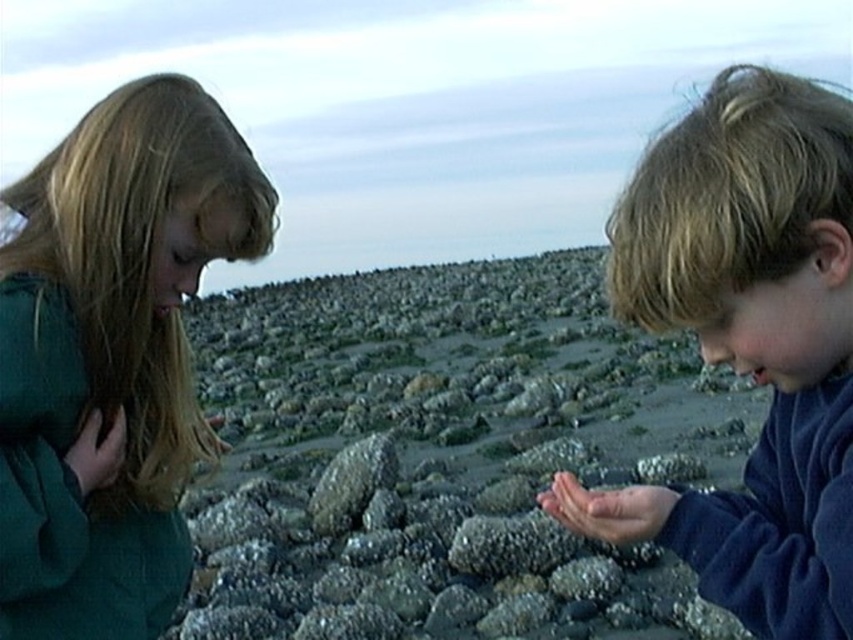
Does smooth brown hair at center come in front of matte green hand at lower left?

Yes, smooth brown hair at center is closer to the viewer.

Looking at this image, does smooth brown hair at center have a greater height compared to matte green hand at lower left?

Indeed, smooth brown hair at center has a greater height compared to matte green hand at lower left.

The width and height of the screenshot is (853, 640). What do you see at coordinates (749, 342) in the screenshot?
I see `smooth brown hair at center` at bounding box center [749, 342].

Locate an element on the screen. smooth brown hair at center is located at coordinates (749, 342).

Is smooth skin hand at lower center taller than matte green hand at lower left?

Incorrect, smooth skin hand at lower center's height is not larger of matte green hand at lower left's.

In the scene shown: Is smooth skin hand at lower center to the right of matte green hand at lower left from the viewer's perspective?

Indeed, smooth skin hand at lower center is positioned on the right side of matte green hand at lower left.

What do you see at coordinates (608, 509) in the screenshot? I see `smooth skin hand at lower center` at bounding box center [608, 509].

Where is `smooth skin hand at lower center`? The height and width of the screenshot is (640, 853). smooth skin hand at lower center is located at coordinates pyautogui.click(x=608, y=509).

Which of these two, smooth gray rocks at center or matte green hand at lower left, stands taller?

With more height is smooth gray rocks at center.

Where is `smooth gray rocks at center`? The width and height of the screenshot is (853, 640). smooth gray rocks at center is located at coordinates (448, 456).

Image resolution: width=853 pixels, height=640 pixels. Describe the element at coordinates (448, 456) in the screenshot. I see `smooth gray rocks at center` at that location.

This screenshot has height=640, width=853. I want to click on smooth gray rocks at center, so click(448, 456).